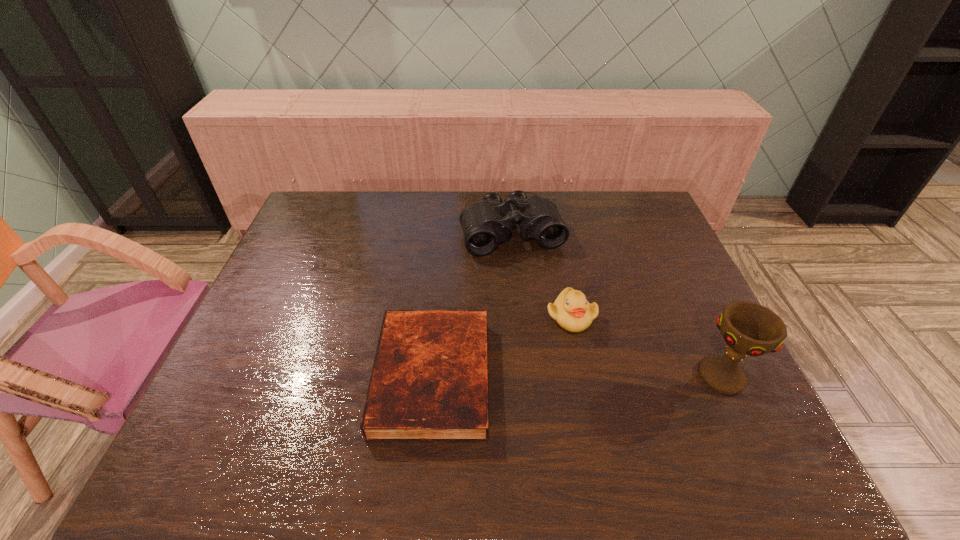
The width and height of the screenshot is (960, 540). In order to click on object located at the near right corner in this screenshot , I will do `click(748, 328)`.

I want to click on vacant space at the far edge of the desktop, so click(x=414, y=206).

I want to click on vacant position at the near edge of the desktop, so click(x=634, y=401).

Locate an element on the screen. The height and width of the screenshot is (540, 960). blank space at the right edge of the desktop is located at coordinates (645, 295).

In the image, there is a desktop. What are the coordinates of `free space at the far left corner` in the screenshot? It's located at (304, 230).

Find the location of a particular element. The image size is (960, 540). free location at the far right corner of the desktop is located at coordinates pyautogui.click(x=612, y=192).

Identify the location of free space between the duckling and the Bible. Image resolution: width=960 pixels, height=540 pixels. (502, 346).

Where is `empty location between the chalice and the shortest object`? empty location between the chalice and the shortest object is located at coordinates (577, 376).

The image size is (960, 540). What are the coordinates of `blank region between the tallest object and the second tallest object` in the screenshot? It's located at (617, 305).

This screenshot has height=540, width=960. I want to click on free space that is in between the tallest object and the Bible, so click(577, 376).